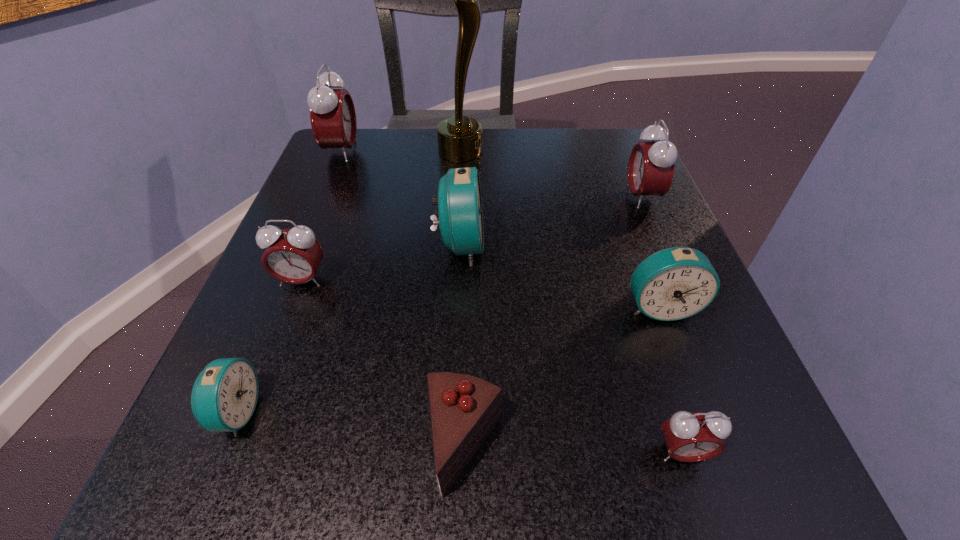
I want to click on the nearest blue alarm clock, so click(224, 396).

Find the location of a particular element. the smallest blue alarm clock is located at coordinates (224, 396).

The width and height of the screenshot is (960, 540). I want to click on the smallest pink alarm clock, so click(689, 437).

Locate an element on the screen. the third pink alarm clock from left to right is located at coordinates (689, 437).

You are a GUI agent. You are given a task and a screenshot of the screen. Output one action in this format:
    pyautogui.click(x=<x>, y=<y>)
    Task: Click on the chocolate cake
    
    Given the screenshot: What is the action you would take?
    (x=464, y=409)

You are a GUI agent. You are given a task and a screenshot of the screen. Output one action in this format:
    pyautogui.click(x=<x>, y=<y>)
    Task: Click on the free spot located on the front-facing side of the tallest object
    
    Given the screenshot: What is the action you would take?
    pyautogui.click(x=541, y=150)

Identify the location of vacant space located 0.390m on the clock face of the farthest pink alarm clock. The image size is (960, 540). (534, 152).

What are the coordinates of `free location located 0.160m on the front-facing side of the second blue alarm clock from left to right` in the screenshot? It's located at coord(578,245).

Identify the location of vacant space located 0.050m on the clock face of the rightmost pink alarm clock. Image resolution: width=960 pixels, height=540 pixels. (602, 197).

Locate an element on the screen. This screenshot has width=960, height=540. free space located 0.180m on the clock face of the rightmost pink alarm clock is located at coordinates (535, 197).